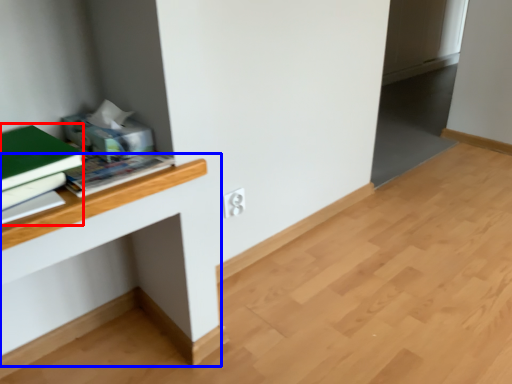
Question: Which of the following is the farthest to the observer, paperback book (highlighted by a red box) or computer desk (highlighted by a blue box)?

Choices:
 (A) paperback book
 (B) computer desk

Answer: (B)